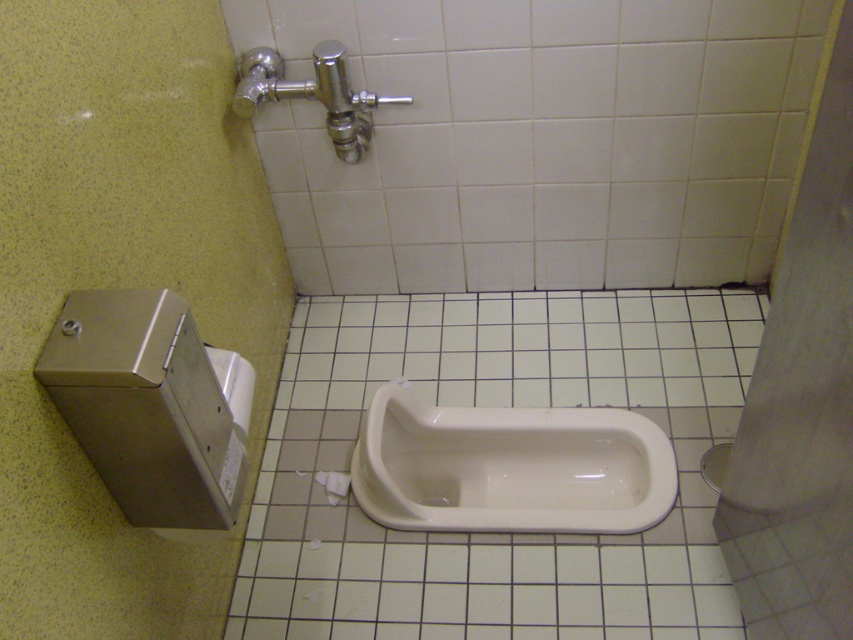
In the scene shown: You are a maintenance worker inspecting the bathroom layout. You need to access the white matte toilet paper at lower center for a repair. Is the white glossy urinal at center blocking your access to it?

The white glossy urinal at center is positioned over white matte toilet paper at lower center, so yes, the urinal is blocking access to the toilet paper.

You are standing in the bathroom and need to reach both the white glossy toilet at center and the white matte toilet paper at lower center. Which object is closer to you?

The white glossy toilet at center is closer to the viewer than the white matte toilet paper at lower center.

You are standing in the bathroom and need to use the facilities. Which one is closer to you, the white glossy toilet at center or the white glossy urinal at center?

The white glossy toilet at center is closer to the viewer than the white glossy urinal at center.